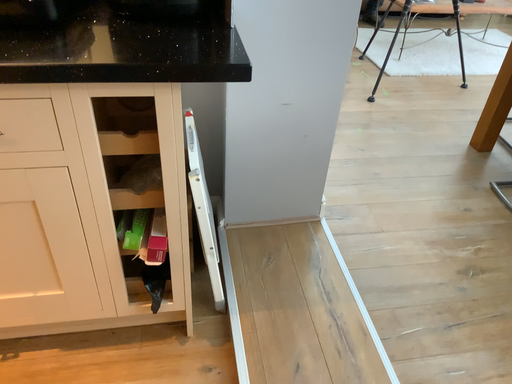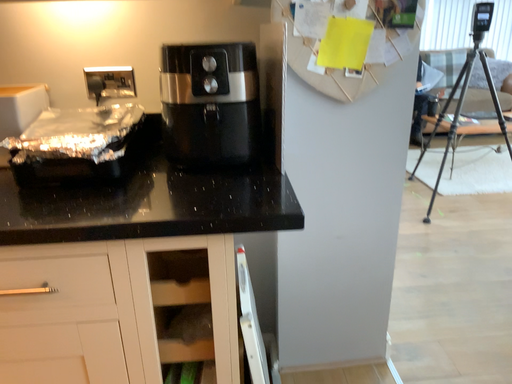
Question: How did the camera likely rotate when shooting the video?

Choices:
 (A) rotated left
 (B) rotated right

Answer: (A)